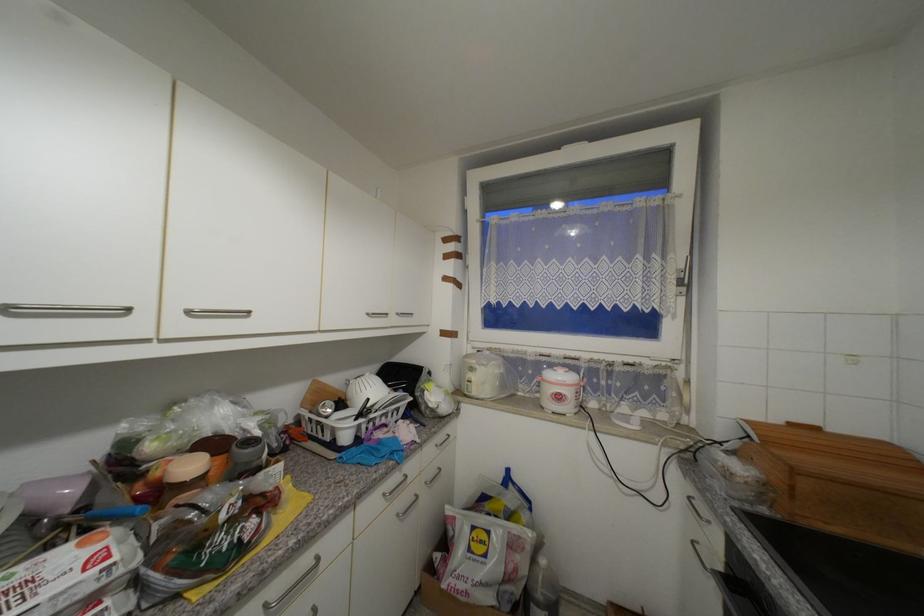
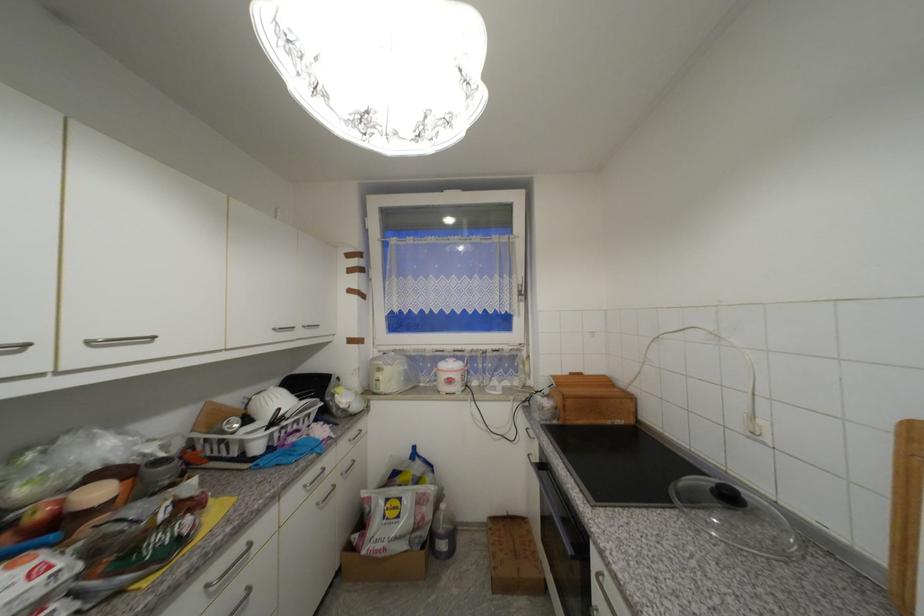
Where in the second image is the point corresponding to (783,422) from the first image?

(572, 374)